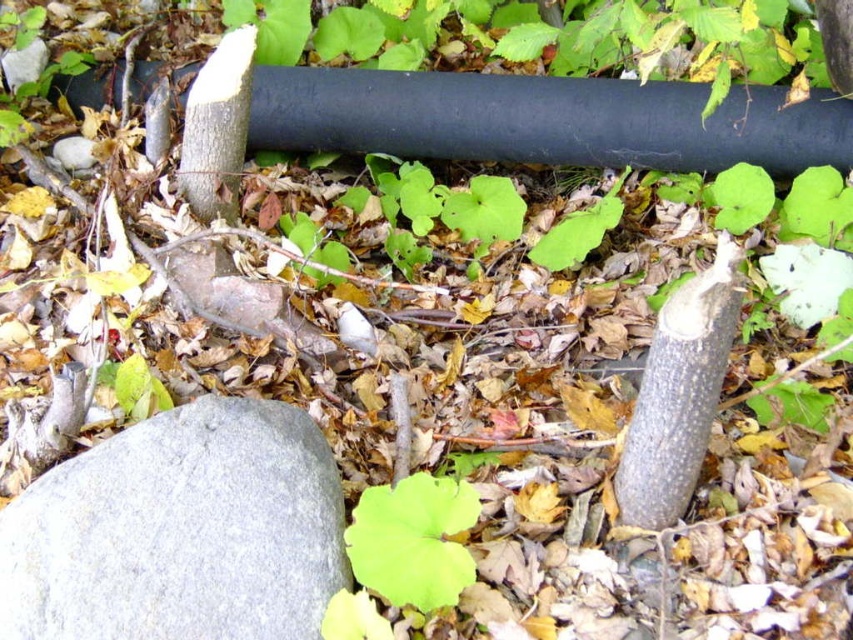
You are a gardener who needs to place a 25 cm wide decorative stone between the gray rough rock at lower left and the green matte leaf at center. Can you fit it in the space between them?

The distance between the gray rough rock at lower left and the green matte leaf at center is 25.58 centimeters. Since the decorative stone is 25 cm wide, it can fit in the space between them as the distance is slightly larger than the stone.

You are a hiker who wants to place a small flag on the highest point between the gray rough rock at lower left and the green matte leaf at center. Which object should you choose to place the flag on?

The gray rough rock at lower left is taller than the green matte leaf at center, so you should place the flag on the gray rough rock at lower left.